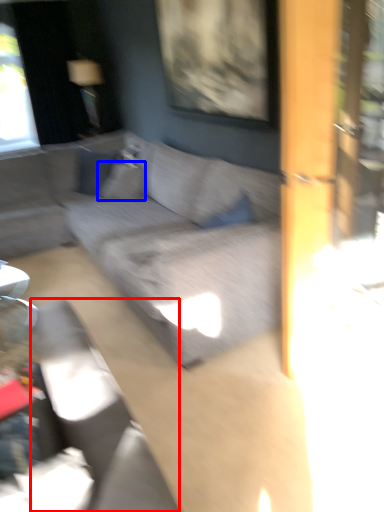
Question: Which of the following is the farthest to the observer, swivel chair (highlighted by a red box) or pillow (highlighted by a blue box)?

Choices:
 (A) swivel chair
 (B) pillow

Answer: (B)